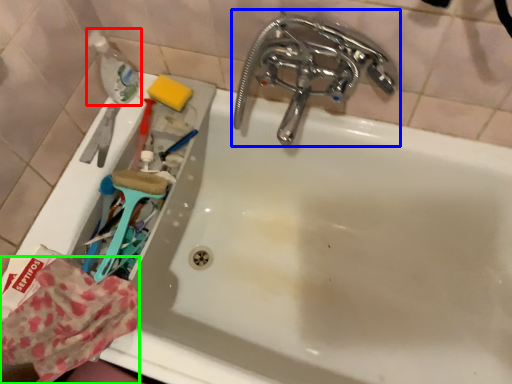
Question: Considering the real-world distances, which object is closest to bottle (highlighted by a red box)? tap (highlighted by a blue box) or material (highlighted by a green box).

Choices:
 (A) tap
 (B) material

Answer: (A)